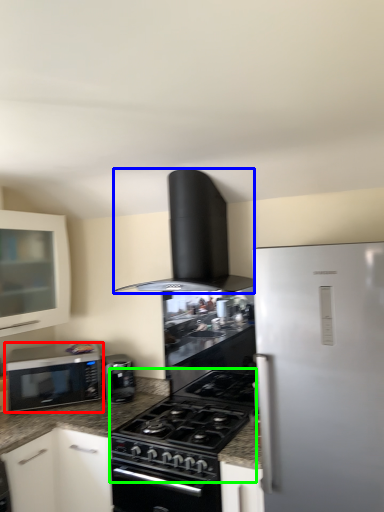
Question: Which object is positioned farthest from microwave oven (highlighted by a red box)? Select from home appliance (highlighted by a blue box) and gas stove (highlighted by a green box).

Choices:
 (A) home appliance
 (B) gas stove

Answer: (A)